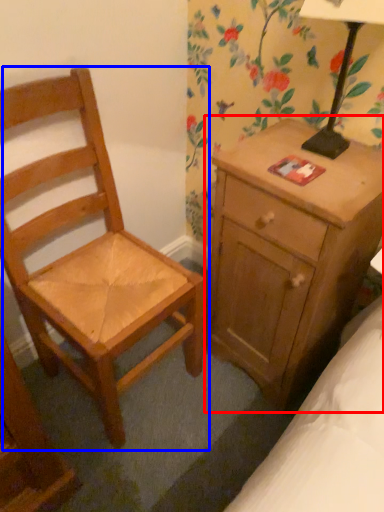
Question: Which object is further to the camera taking this photo, nightstand (highlighted by a red box) or chair (highlighted by a blue box)?

Choices:
 (A) nightstand
 (B) chair

Answer: (A)